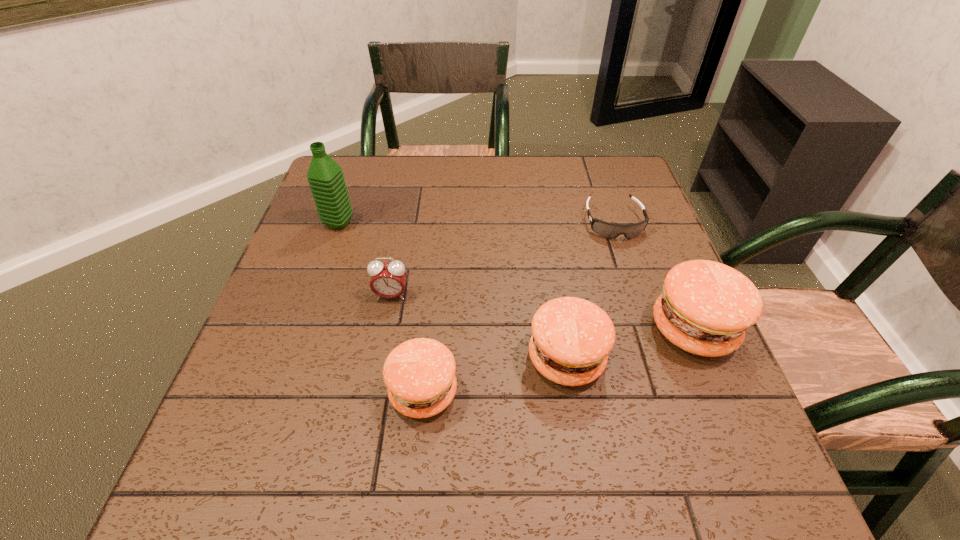
Select which object is the second closest to the leftmost object. Please provide its 2D coordinates. Your answer should be formatted as a tuple, i.e. [(x, y)], where the tuple contains the x and y coordinates of a point satisfying the conditions above.

[(420, 376)]

Locate an element on the screen. The height and width of the screenshot is (540, 960). the closest patty to the alarm clock is located at coordinates (420, 376).

At what (x,y) coordinates should I click in order to perform the action: click on the closest patty to the shortest patty. Please return your answer as a coordinate pair (x, y). The width and height of the screenshot is (960, 540). Looking at the image, I should click on (572, 337).

Locate an element on the screen. blank area in the image that satisfies the following two spatial constraints: 1. on the front and sides of the shortest object; 2. on the left side of the rightmost patty is located at coordinates (649, 329).

At what (x,y) coordinates should I click in order to perform the action: click on free space that satisfies the following two spatial constraints: 1. on the clock face of the second patty from left to right; 2. on the left side of the alarm clock. Please return your answer as a coordinate pair (x, y). This screenshot has width=960, height=540. Looking at the image, I should click on (380, 359).

Locate an element on the screen. This screenshot has width=960, height=540. free space that satisfies the following two spatial constraints: 1. on the clock face of the rightmost patty; 2. on the right side of the alarm clock is located at coordinates (385, 329).

Where is `vacant region that satisfies the following two spatial constraints: 1. on the back side of the second patty from left to right; 2. on the right side of the leftmost patty`? The height and width of the screenshot is (540, 960). vacant region that satisfies the following two spatial constraints: 1. on the back side of the second patty from left to right; 2. on the right side of the leftmost patty is located at coordinates (427, 359).

Locate an element on the screen. This screenshot has width=960, height=540. blank space that satisfies the following two spatial constraints: 1. on the front and sides of the rightmost patty; 2. on the left side of the goggles is located at coordinates (649, 329).

You are a GUI agent. You are given a task and a screenshot of the screen. Output one action in this format:
    pyautogui.click(x=<x>, y=<y>)
    Task: Click on the vacant area in the image that satisfies the following two spatial constraints: 1. on the clock face of the alarm clock; 2. on the left side of the second patty from left to right
    The width and height of the screenshot is (960, 540).
    Given the screenshot: What is the action you would take?
    pyautogui.click(x=380, y=359)